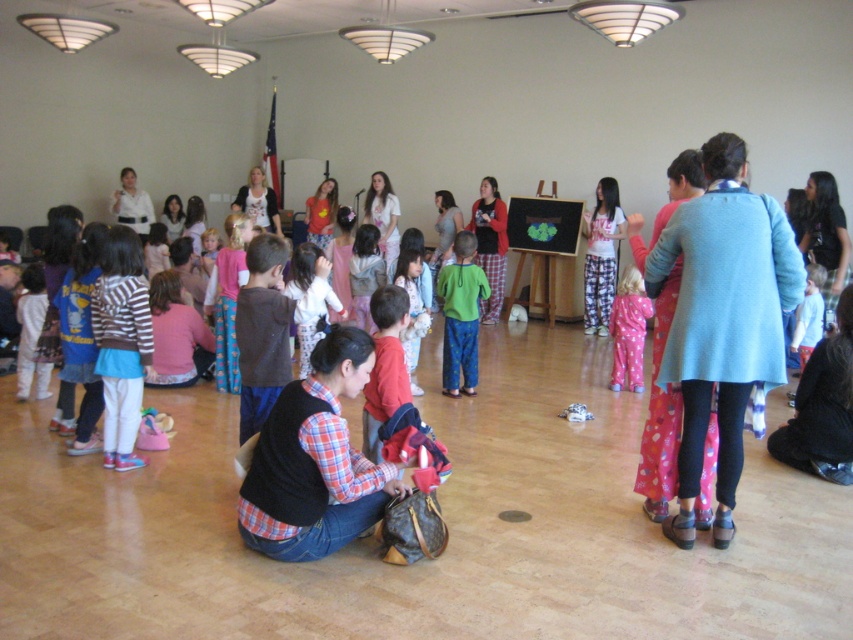
Question: Which is farther from the blue wool coat at right?

Choices:
 (A) pink pajama pants at center
 (B) white cotton shirt at center

Answer: (B)

Question: Does striped cotton shirt at lower left have a lesser width compared to green cotton shirt at center?

Choices:
 (A) yes
 (B) no

Answer: (B)

Question: Does blue wool coat at right appear under plaid shirt at center?

Choices:
 (A) no
 (B) yes

Answer: (A)

Question: Which is nearer to the pink pajama pants at center?

Choices:
 (A) green cotton shirt at center
 (B) blue wool coat at right
 (C) plaid shirt at center
 (D) striped cotton shirt at lower left

Answer: (A)

Question: In this image, where is striped cotton shirt at lower left located relative to white cotton shirt at center?

Choices:
 (A) left
 (B) right

Answer: (A)

Question: Which object appears closest to the camera in this image?

Choices:
 (A) striped cotton shirt at lower left
 (B) pink pajama pants at center

Answer: (A)